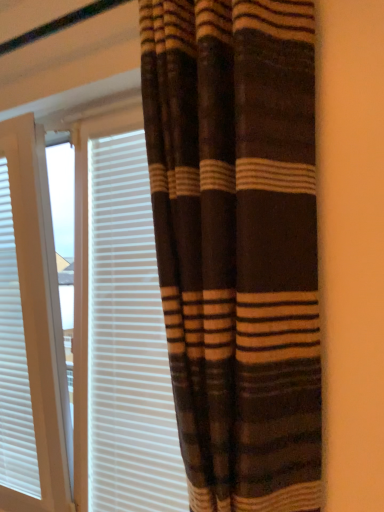
Question: Considering the relative sizes of white textured blinds at left and white textured blinds at center in the image provided, is white textured blinds at left wider than white textured blinds at center?

Choices:
 (A) yes
 (B) no

Answer: (A)

Question: Can white textured blinds at center be found inside white textured blinds at left?

Choices:
 (A) no
 (B) yes

Answer: (A)

Question: From a real-world perspective, is white textured blinds at left below white textured blinds at center?

Choices:
 (A) yes
 (B) no

Answer: (A)

Question: Is white textured blinds at left looking in the opposite direction of white textured blinds at center?

Choices:
 (A) no
 (B) yes

Answer: (A)

Question: Could you tell me if white textured blinds at left is facing white textured blinds at center?

Choices:
 (A) yes
 (B) no

Answer: (B)

Question: Is white textured blinds at center bigger or smaller than white textured blinds at left?

Choices:
 (A) small
 (B) big

Answer: (A)

Question: From the image's perspective, relative to white textured blinds at left, is white textured blinds at center above or below?

Choices:
 (A) above
 (B) below

Answer: (A)

Question: Is point (140, 338) positioned closer to the camera than point (6, 323)?

Choices:
 (A) farther
 (B) closer

Answer: (B)

Question: From a real-world perspective, relative to white textured blinds at left, is white textured blinds at center vertically above or below?

Choices:
 (A) above
 (B) below

Answer: (A)

Question: From a real-world perspective, relative to white textured blinds at left, is brown striped curtain at center vertically above or below?

Choices:
 (A) above
 (B) below

Answer: (A)

Question: Looking at the image, does brown striped curtain at center seem bigger or smaller compared to white textured blinds at left?

Choices:
 (A) small
 (B) big

Answer: (B)

Question: Choose the correct answer: Is brown striped curtain at center inside white textured blinds at left or outside it?

Choices:
 (A) outside
 (B) inside

Answer: (A)

Question: In terms of width, does brown striped curtain at center look wider or thinner when compared to white textured blinds at left?

Choices:
 (A) thin
 (B) wide

Answer: (B)

Question: Is white textured blinds at center wider or thinner than brown striped curtain at center?

Choices:
 (A) thin
 (B) wide

Answer: (A)

Question: Would you say white textured blinds at center is inside or outside brown striped curtain at center?

Choices:
 (A) outside
 (B) inside

Answer: (A)